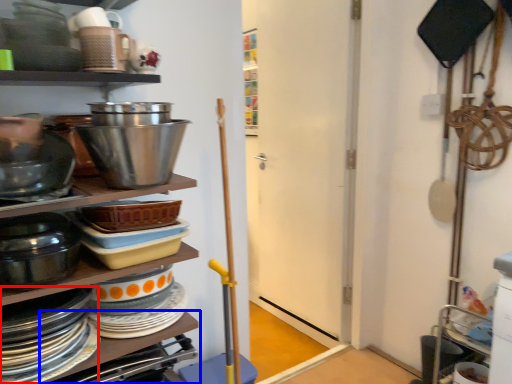
Question: Which object is further to the camera taking this photo, platter (highlighted by a red box) or table (highlighted by a blue box)?

Choices:
 (A) platter
 (B) table

Answer: (B)